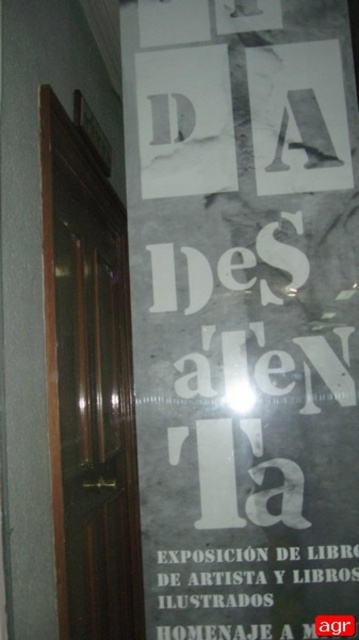
Question: Is white paper poster at center further to the viewer compared to brown polished wood door at left?

Choices:
 (A) yes
 (B) no

Answer: (B)

Question: Observing the image, what is the correct spatial positioning of white paper poster at center in reference to brown polished wood door at left?

Choices:
 (A) right
 (B) left

Answer: (A)

Question: Which point is closer to the camera?

Choices:
 (A) white paper sign at lower center
 (B) white paper poster at center
 (C) brown polished wood door at left

Answer: (A)

Question: Is white paper poster at center below brown polished wood door at left?

Choices:
 (A) yes
 (B) no

Answer: (B)

Question: Which object is closer to the camera taking this photo?

Choices:
 (A) brown polished wood door at left
 (B) white paper sign at lower center
 (C) white paper poster at center

Answer: (B)

Question: Among these points, which one is farthest from the camera?

Choices:
 (A) (347, 568)
 (B) (80, 141)
 (C) (179, 436)

Answer: (B)